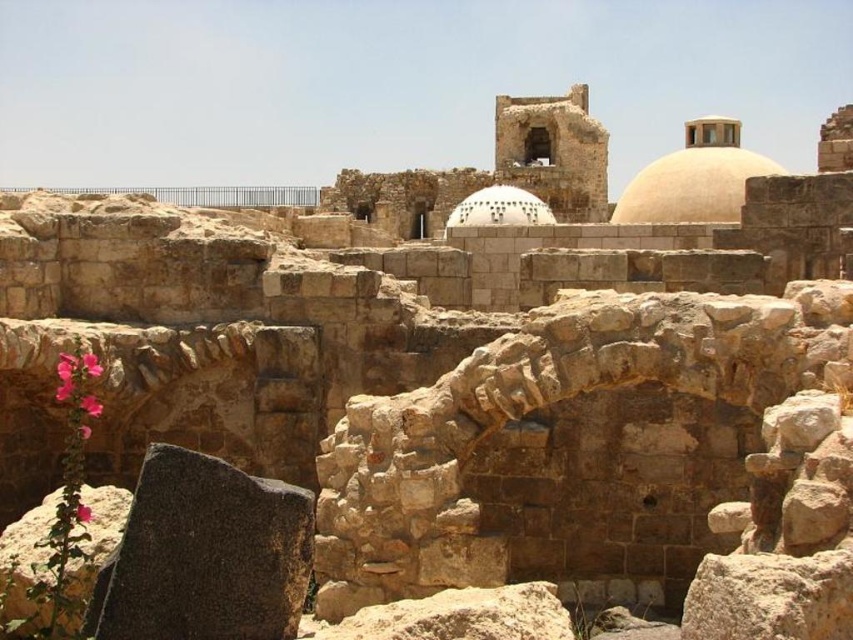
You are standing at the viewpoint of the image and want to take a photo of the ancient stone structure. There are two points marked in the image at coordinates point (619, 196) and point (485, 198). Which point is closer to the front of the image?

Point (485, 198) is closer to the front of the image because point (619, 196) is behind it.

You are standing at the entrance of the ancient stone structure. You see a point marked at coordinates (694, 179). What does this point represent?

The point at coordinates (694, 179) represents the beige stone dome at upper center.